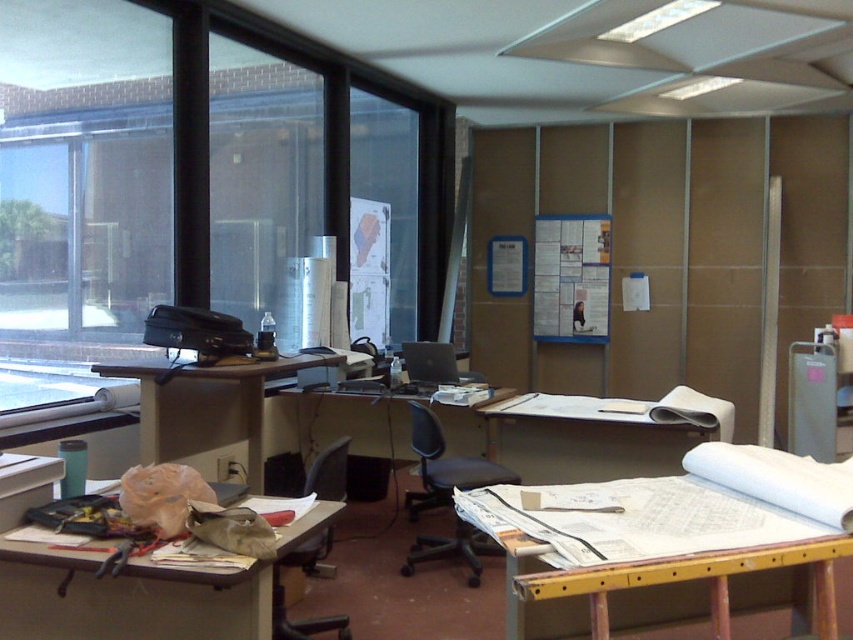
You are a delivery person who needs to place a large package between the wooden drafting table at center and the matte plastic desk at center. Is there enough space to fit the package, which is 1.8 meters long, between them?

The wooden drafting table at center and the matte plastic desk at center are 2.00 meters apart. Since the package is 1.8 meters long, there is enough space to fit it between them.

You are standing in the office and need to move from the entrance to the wooden drafting table at center. There is a black plastic chair at lower center in your path. Can you step over the chair to reach the table?

The wooden drafting table at center is above the black plastic chair at lower center, so yes, you can step over the chair to reach the table.